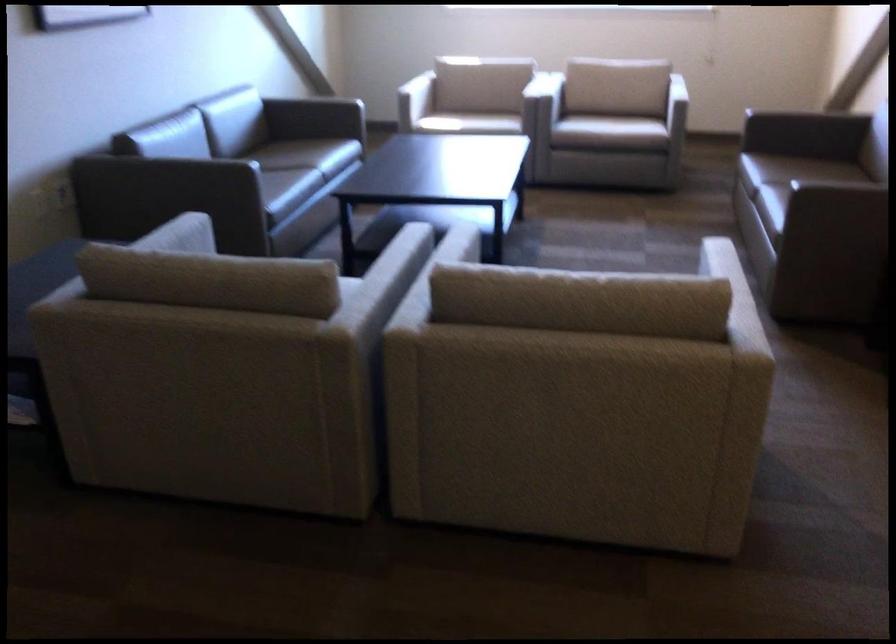
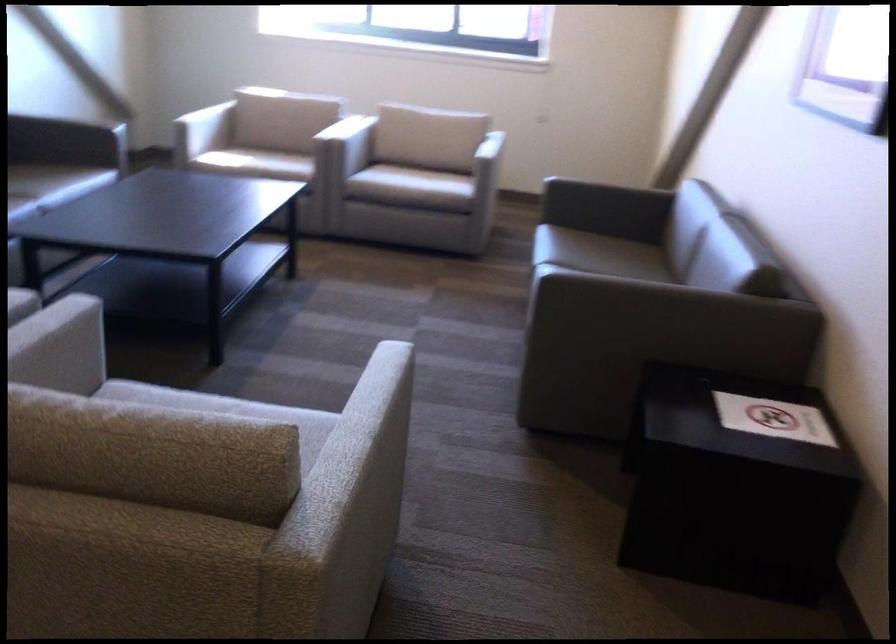
Question: The first image is from the beginning of the video and the second image is from the end. How did the camera likely rotate when shooting the video?

Choices:
 (A) Left
 (B) Right
 (C) Up
 (D) Down

Answer: (B)